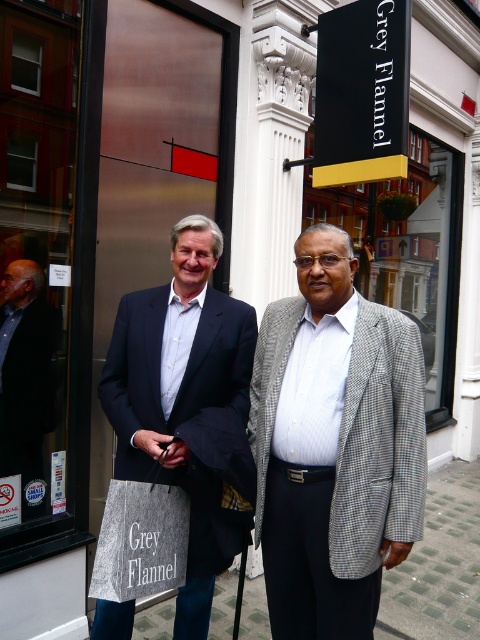
You are a photographer trying to capture the man in the gray checkered blazer at center. The camera you are using has a focus point at coordinate point (x=379, y=442). Will this point be on the correct subject?

Yes, the point (x=379, y=442) is on the gray checkered blazer at center, so the focus point will be on the correct subject.

You are a delivery person trying to read the store sign. Which sign, the brushed metal sign at center or the black glass sign at center, is closer to the ground?

The brushed metal sign at center is positioned under the black glass sign at center, so the brushed metal sign at center is closer to the ground.

You are a tailor measuring the distance between two suits displayed in a store window. The suits are the checkered fabric suit at center and the matte black suit at left. The store requires a minimum of 1 meter between displayed items for safety. Can the current spacing between these two suits meet the store requirement?

The checkered fabric suit at center and matte black suit at left are 1.11 meters apart from each other, which exceeds the store requirement of 1 meter. Therefore, the current spacing between these two suits meets the store requirement.